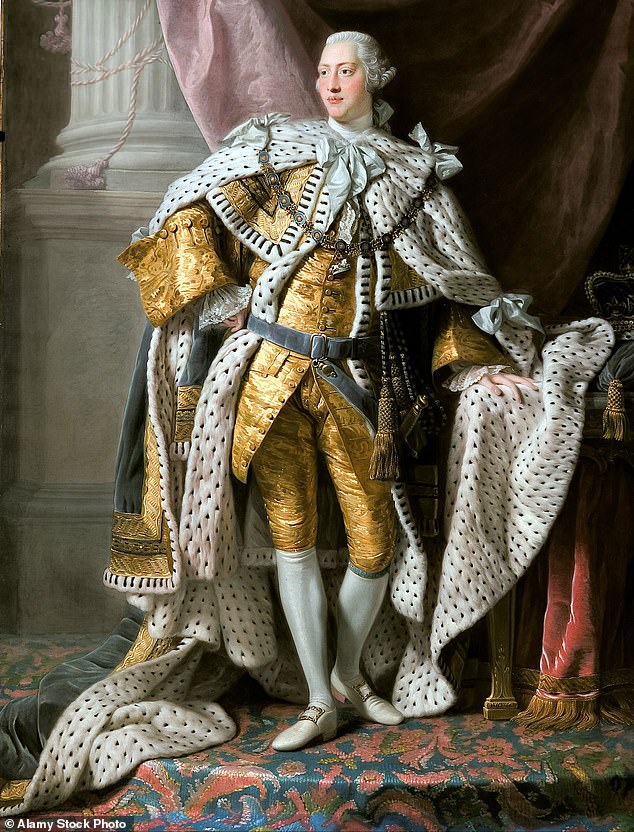
In order to click on colorful rug under throne in this screenshot , I will do `click(417, 765)`.